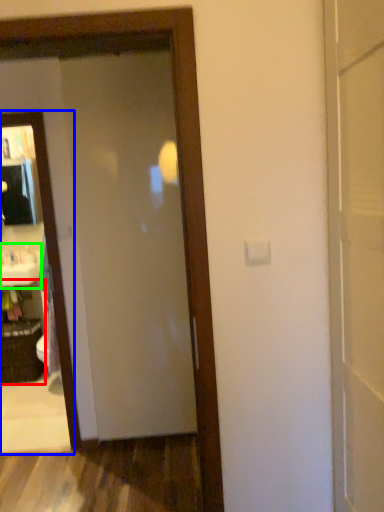
Question: Estimate the real-world distances between objects in this image. Which object is closer to cabinetry (highlighted by a red box), mirror (highlighted by a blue box) or sink (highlighted by a green box)?

Choices:
 (A) mirror
 (B) sink

Answer: (B)